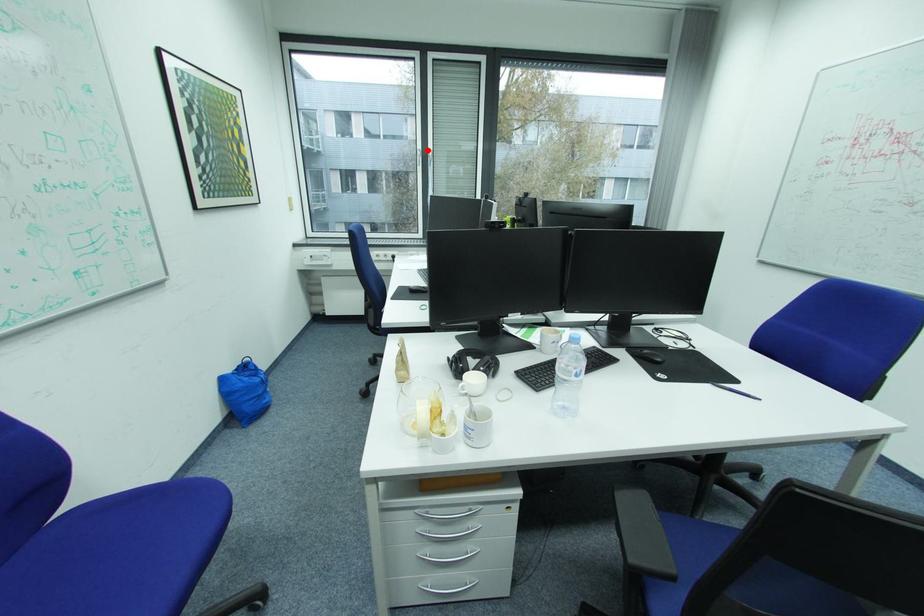
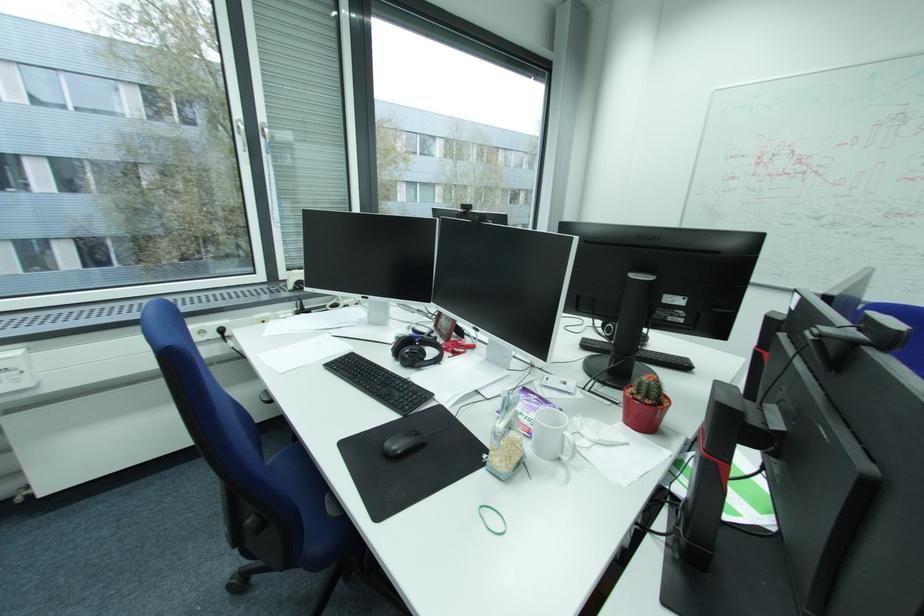
Where in the second image is the point corresponding to the highlighted location from the first image?

(247, 121)